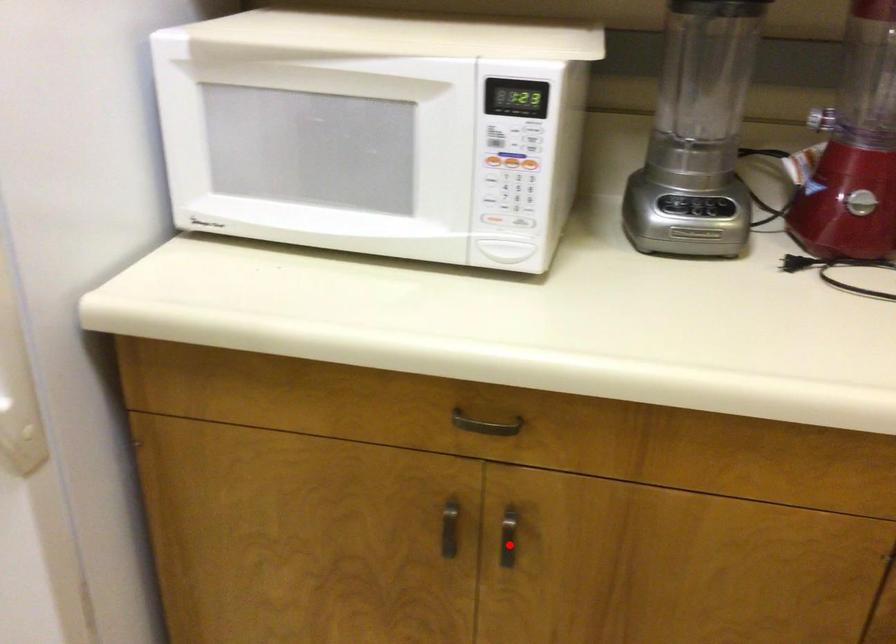
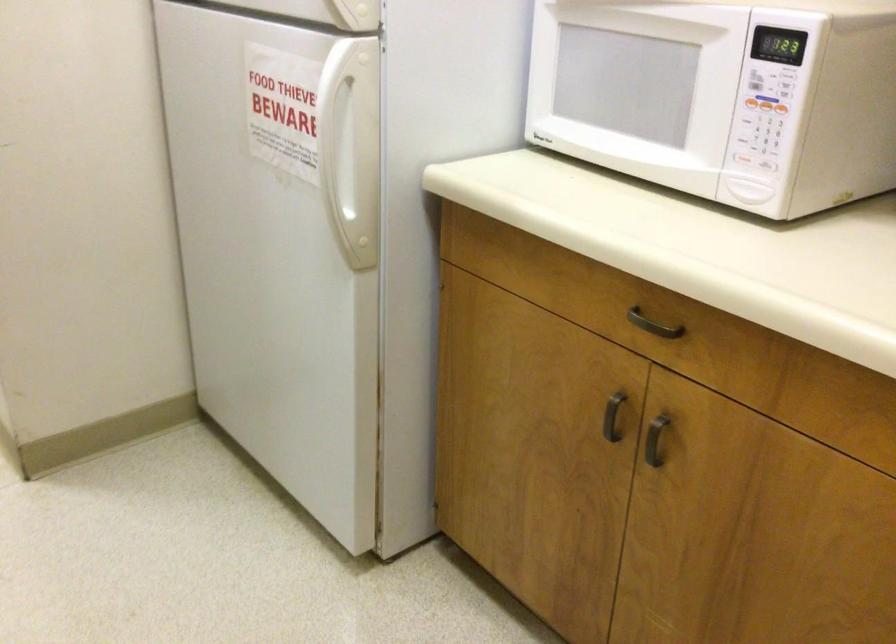
Where in the second image is the point corresponding to the highlighted location from the first image?

(655, 440)